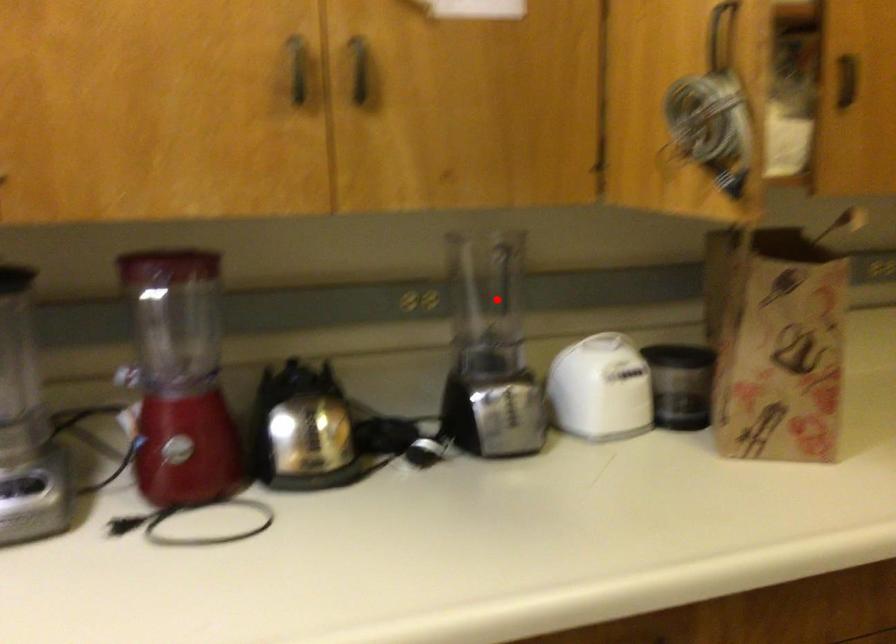
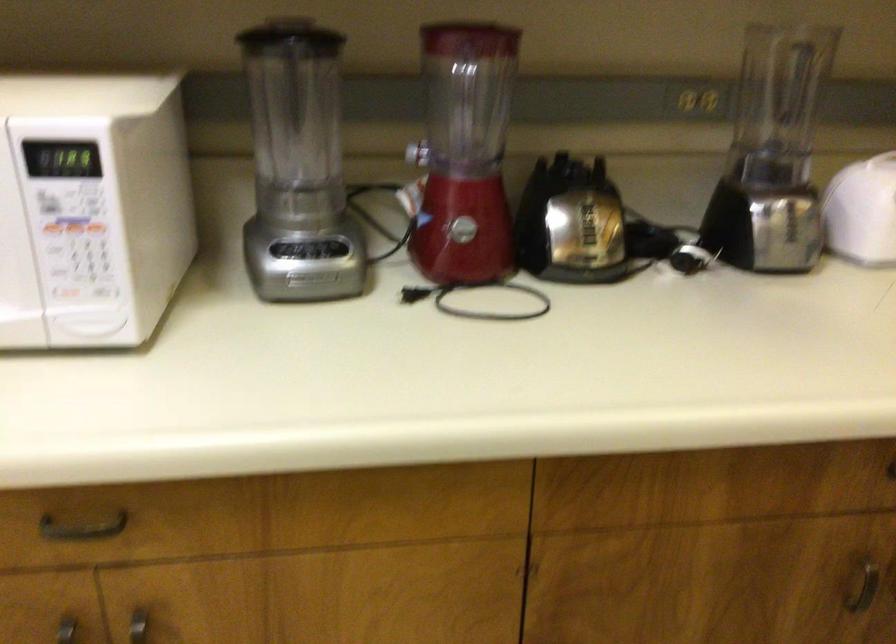
Find the pixel in the second image that matches the highlighted location in the first image.

(779, 100)